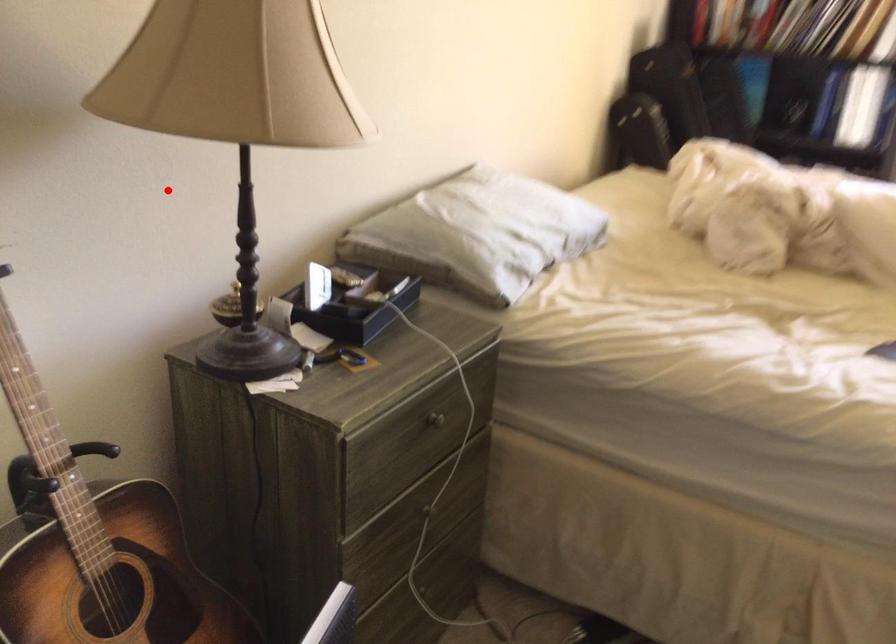
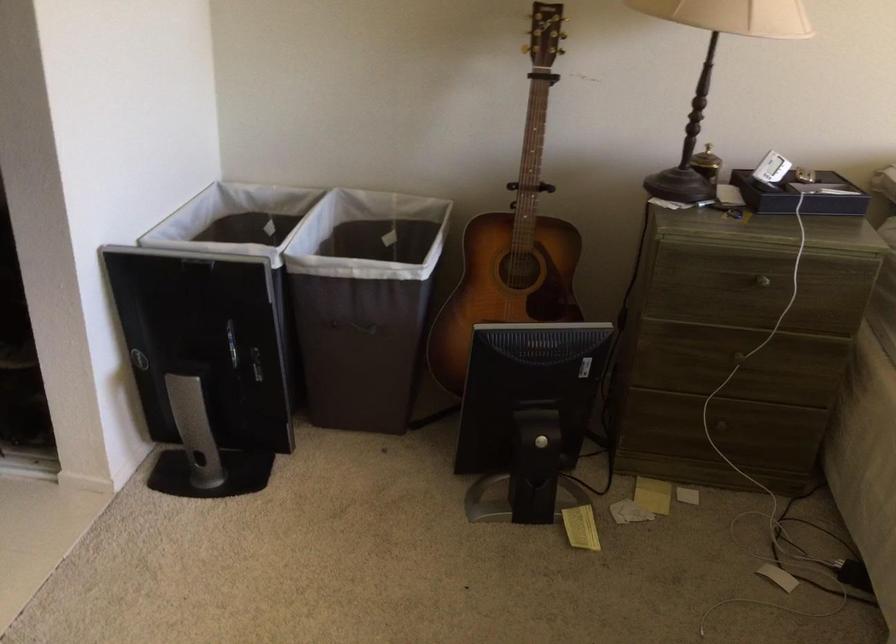
Where in the second image is the point corresponding to the highlighted location from the first image?

(714, 69)